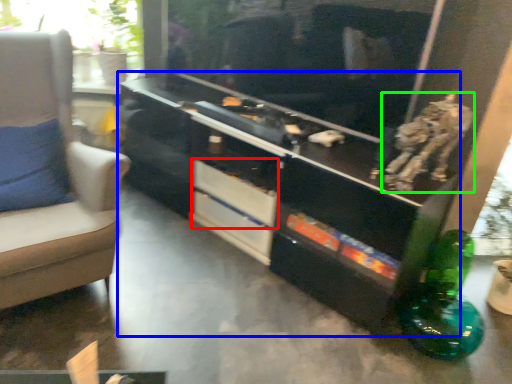
Question: Which is nearer to the drawer (highlighted by a red box)? entertainment center (highlighted by a blue box) or animal (highlighted by a green box).

Choices:
 (A) entertainment center
 (B) animal

Answer: (A)